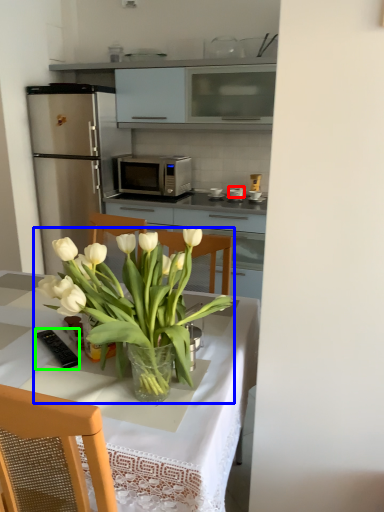
Question: Which object is the farthest from appliance (highlighted by a red box)? Choose among these: houseplant (highlighted by a blue box) or appliance (highlighted by a green box).

Choices:
 (A) houseplant
 (B) appliance

Answer: (A)